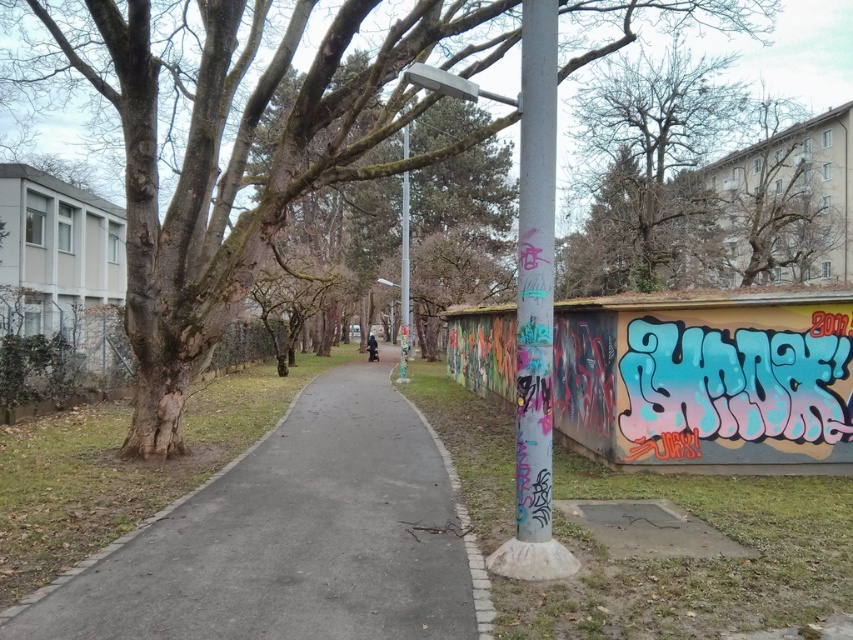
Question: Is gray asphalt pavement at center closer to camera compared to bare branches at upper center?

Choices:
 (A) no
 (B) yes

Answer: (B)

Question: Which of these objects is positioned farthest from the gray asphalt pavement at center?

Choices:
 (A) brown rough tree at upper left
 (B) graffiti-covered metal pole at center-right
 (C) bare branches at upper center

Answer: (C)

Question: Estimate the real-world distances between objects in this image. Which object is farther from the gray asphalt pavement at center?

Choices:
 (A) smooth gray pole at center
 (B) graffiti-covered metal pole at center-right
 (C) brown rough tree at upper left
 (D) bare branches at upper center

Answer: (D)

Question: Among these points, which one is nearest to the camera?

Choices:
 (A) (347, 381)
 (B) (407, 268)

Answer: (B)

Question: Can you confirm if gray asphalt pavement at center is positioned below smooth gray pole at center?

Choices:
 (A) yes
 (B) no

Answer: (A)

Question: Is graffiti-covered metal pole at center-right positioned before smooth gray pole at center?

Choices:
 (A) yes
 (B) no

Answer: (A)